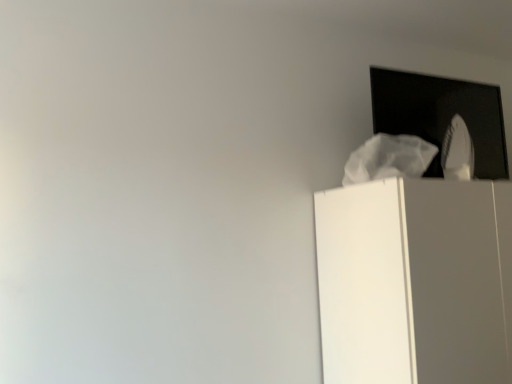
The width and height of the screenshot is (512, 384). What are the coordinates of `white matte cabinet at upper right` in the screenshot? It's located at click(x=415, y=281).

In order to face white matte cabinet at upper right, should I rotate leftwards or rightwards?

Turn right approximately 28.106 degrees to face it.

The width and height of the screenshot is (512, 384). Describe the element at coordinates (415, 281) in the screenshot. I see `white matte cabinet at upper right` at that location.

The image size is (512, 384). I want to click on black glass window at upper right, so click(441, 115).

What do you see at coordinates (441, 115) in the screenshot?
I see `black glass window at upper right` at bounding box center [441, 115].

The height and width of the screenshot is (384, 512). What are the coordinates of `white matte cabinet at upper right` in the screenshot? It's located at (415, 281).

Considering the positions of objects white matte cabinet at upper right and black glass window at upper right in the image provided, who is more to the left, white matte cabinet at upper right or black glass window at upper right?

black glass window at upper right is more to the left.

Does white matte cabinet at upper right come behind black glass window at upper right?

No, white matte cabinet at upper right is closer to the camera.

Which point is more forward, (390, 209) or (489, 89)?

The point (390, 209) is closer to the camera.

Based on the photo, from the image's perspective, which one is positioned lower, white matte cabinet at upper right or black glass window at upper right?

white matte cabinet at upper right appears lower in the image.

From a real-world perspective, which object stands above the other?

In real-world perspective, black glass window at upper right is above.

Which of these two, white matte cabinet at upper right or black glass window at upper right, is thinner?

With smaller width is black glass window at upper right.

Is white matte cabinet at upper right taller or shorter than black glass window at upper right?

Clearly, white matte cabinet at upper right is taller compared to black glass window at upper right.

Is white matte cabinet at upper right smaller than black glass window at upper right?

Incorrect, white matte cabinet at upper right is not smaller in size than black glass window at upper right.

Do you think white matte cabinet at upper right is within black glass window at upper right, or outside of it?

white matte cabinet at upper right cannot be found inside black glass window at upper right.

Is white matte cabinet at upper right touching black glass window at upper right?

No, white matte cabinet at upper right is not beside black glass window at upper right.

Is white matte cabinet at upper right oriented away from black glass window at upper right?

No, white matte cabinet at upper right is not facing the opposite direction of black glass window at upper right.

In order to click on window behind the white matte cabinet at upper right in this screenshot , I will do `click(441, 115)`.

Consider the image. Can you confirm if black glass window at upper right is positioned to the left of white matte cabinet at upper right?

Indeed, black glass window at upper right is positioned on the left side of white matte cabinet at upper right.

Is black glass window at upper right closer to camera compared to white matte cabinet at upper right?

No, it is behind white matte cabinet at upper right.

Which is farther, (478, 169) or (414, 275)?

The point (478, 169) is behind.

From the picture: From the image's perspective, between black glass window at upper right and white matte cabinet at upper right, who is located below?

white matte cabinet at upper right is shown below in the image.

Based on the photo, from a real-world perspective, which is physically below, black glass window at upper right or white matte cabinet at upper right?

white matte cabinet at upper right is physically lower.

Considering the sizes of black glass window at upper right and white matte cabinet at upper right in the image, is black glass window at upper right wider or thinner than white matte cabinet at upper right?

Clearly, black glass window at upper right has less width compared to white matte cabinet at upper right.

Considering the sizes of black glass window at upper right and white matte cabinet at upper right in the image, is black glass window at upper right taller or shorter than white matte cabinet at upper right?

In the image, black glass window at upper right appears to be shorter than white matte cabinet at upper right.

Who is smaller, black glass window at upper right or white matte cabinet at upper right?

With smaller size is black glass window at upper right.

Is black glass window at upper right spatially inside white matte cabinet at upper right, or outside of it?

black glass window at upper right cannot be found inside white matte cabinet at upper right.

Is black glass window at upper right with white matte cabinet at upper right?

There is a gap between black glass window at upper right and white matte cabinet at upper right.

Is black glass window at upper right facing towards white matte cabinet at upper right?

No, black glass window at upper right is not facing towards white matte cabinet at upper right.

Measure the distance between black glass window at upper right and white matte cabinet at upper right.

black glass window at upper right is 22.10 inches from white matte cabinet at upper right.

What are the coordinates of `furniture lying on the right of black glass window at upper right` in the screenshot? It's located at (415, 281).

Identify the location of furniture in front of the black glass window at upper right. This screenshot has height=384, width=512. (415, 281).

Identify the location of window behind the white matte cabinet at upper right. coord(441,115).